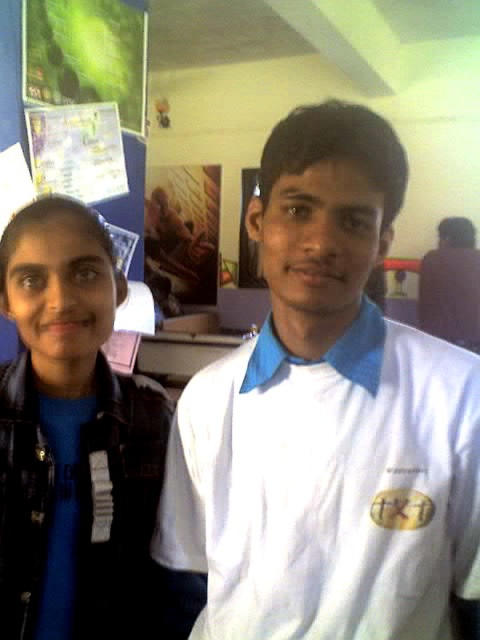
Question: Which of these objects is positioned closest to the matte plastic poster at upper left?

Choices:
 (A) green matte poster at upper left
 (B) wooden carved figure at upper center
 (C) white cotton shirt at center
 (D) blue matte jacket at left

Answer: (A)

Question: Estimate the real-world distances between objects in this image. Which object is closer to the matte plastic poster at upper left?

Choices:
 (A) wooden carved figure at upper center
 (B) green matte poster at upper left
 (C) white cotton shirt at center

Answer: (B)

Question: Can you confirm if white cotton shirt at center is bigger than matte plastic poster at upper left?

Choices:
 (A) yes
 (B) no

Answer: (A)

Question: Which point is farther to the camera?

Choices:
 (A) white cotton shirt at center
 (B) green matte poster at upper left
 (C) blue matte jacket at left
 (D) matte plastic poster at upper left

Answer: (D)

Question: Is blue matte jacket at left to the left of wooden carved figure at upper center from the viewer's perspective?

Choices:
 (A) yes
 (B) no

Answer: (B)

Question: Does white cotton shirt at center appear over blue matte jacket at left?

Choices:
 (A) no
 (B) yes

Answer: (B)